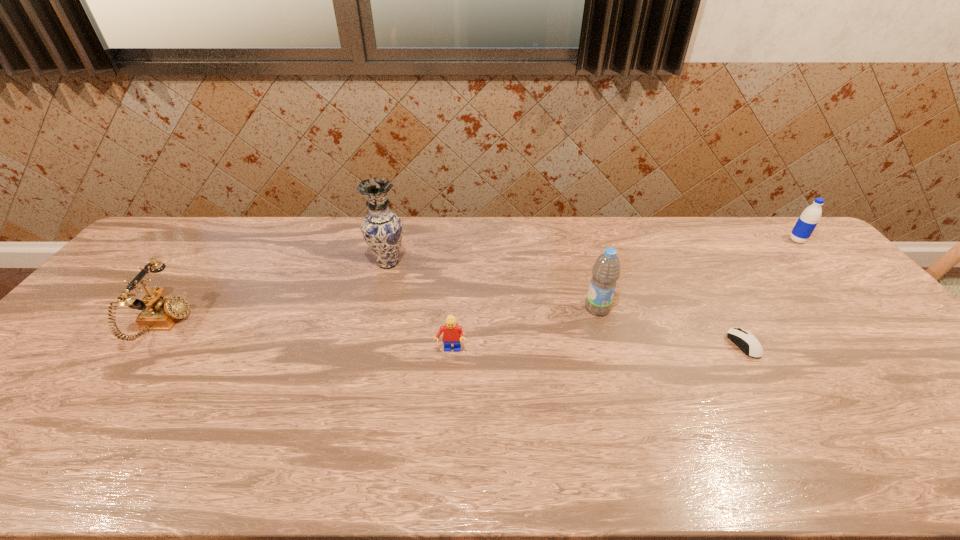
Where is `object that is at the far right corner`? The width and height of the screenshot is (960, 540). object that is at the far right corner is located at coordinates (810, 217).

You are a GUI agent. You are given a task and a screenshot of the screen. Output one action in this format:
    pyautogui.click(x=<x>, y=<y>)
    Task: Click on the vacant space at the far edge of the desktop
    This screenshot has height=540, width=960.
    Given the screenshot: What is the action you would take?
    pyautogui.click(x=405, y=223)

Find the location of a particular element. Image resolution: width=960 pixels, height=540 pixels. vacant space at the near edge is located at coordinates (373, 476).

The height and width of the screenshot is (540, 960). Find the location of `vacant space at the left edge of the desktop`. vacant space at the left edge of the desktop is located at coordinates [x=81, y=370].

Where is `free space at the far left corner of the desktop`? This screenshot has height=540, width=960. free space at the far left corner of the desktop is located at coordinates (209, 226).

Identify the location of vacant space at the far right corner of the desktop. (775, 232).

The width and height of the screenshot is (960, 540). Find the location of `vacant area that lies between the taller water bottle and the fifth tallest object`. vacant area that lies between the taller water bottle and the fifth tallest object is located at coordinates (524, 329).

The image size is (960, 540). Find the location of `empty location between the fourth object from left to right and the rightmost object`. empty location between the fourth object from left to right and the rightmost object is located at coordinates (697, 274).

Identify the location of free space that is in between the fourth object from right to left and the shortest object. The height and width of the screenshot is (540, 960). (597, 348).

Image resolution: width=960 pixels, height=540 pixels. What are the coordinates of `vacant space in between the fourth object from right to left and the tallest object` in the screenshot? It's located at (420, 307).